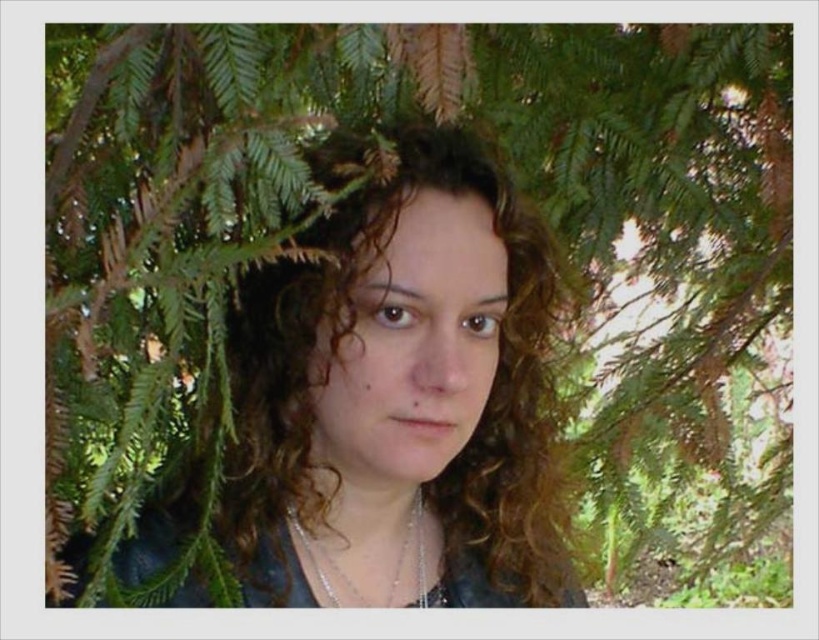
You are a photographer trying to capture a portrait of the person in the scene. You want to ensure that the subject is in focus while the background remains slightly blurred. Given that your camera has a depth of field setting, what is the minimum distance you should set the focus point to capture the person clearly, considering the point at coordinates point (562, 596) is 75.48 centimeters away from the camera?

To ensure the person is in focus while keeping the background blurred, set the focus point to at least 75.48 centimeters, which is the distance of point (562, 596) from the camera. This will keep the subject sharp while allowing the background to blur.

You are a photographer trying to capture a portrait of the person in the scene. The curly hair at center and the silver metallic necklace at center are both important elements. Which object should you adjust your focus on first to ensure both are in frame?

Since the curly hair at center is located above the silver metallic necklace at center, you should focus on the curly hair at center first to ensure both elements are captured within the frame.

You are taking a photo of the person in the scene. The curly hair at center and silver metallic necklace at center are both in the frame. To ensure the necklace is visible, should you adjust the camera to focus more to the left or right of the current position?

The curly hair at center is to the right of the silver metallic necklace at center. To focus on the necklace, you should adjust the camera to the left since the necklace is positioned to the left of the hair.